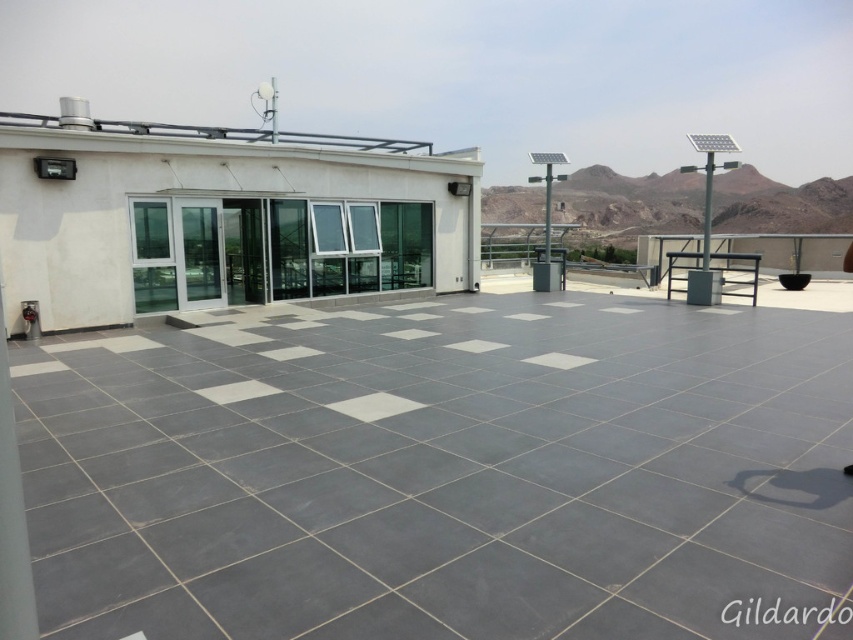
Question: Which object is closer to the camera taking this photo?

Choices:
 (A) white glass terrace at upper left
 (B) gray tile at center

Answer: (B)

Question: Which object appears closest to the camera in this image?

Choices:
 (A) white glass terrace at upper left
 (B) gray tile at center

Answer: (B)

Question: Which object is closer to the camera taking this photo?

Choices:
 (A) gray tile at center
 (B) white glass terrace at upper left

Answer: (A)

Question: Is gray tile at center smaller than white glass terrace at upper left?

Choices:
 (A) yes
 (B) no

Answer: (A)

Question: In this image, where is gray tile at center located relative to white glass terrace at upper left?

Choices:
 (A) above
 (B) below

Answer: (B)

Question: Is gray tile at center below white glass terrace at upper left?

Choices:
 (A) yes
 (B) no

Answer: (A)